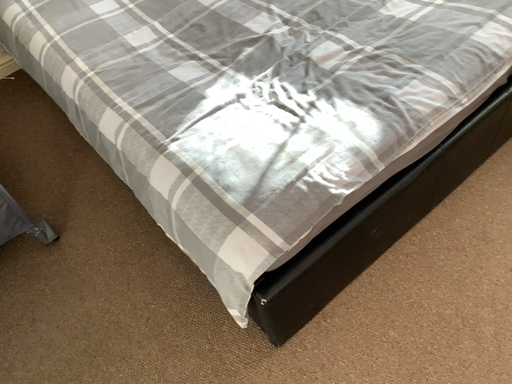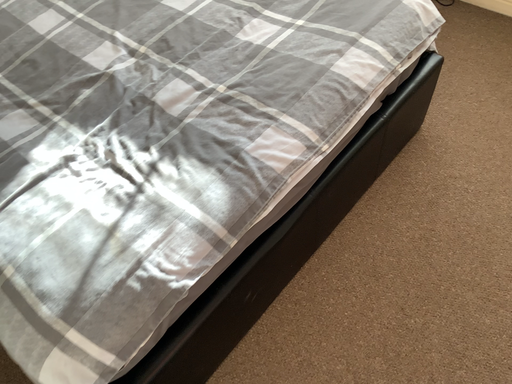
Question: How did the camera likely rotate when shooting the video?

Choices:
 (A) rotated left
 (B) rotated right

Answer: (B)